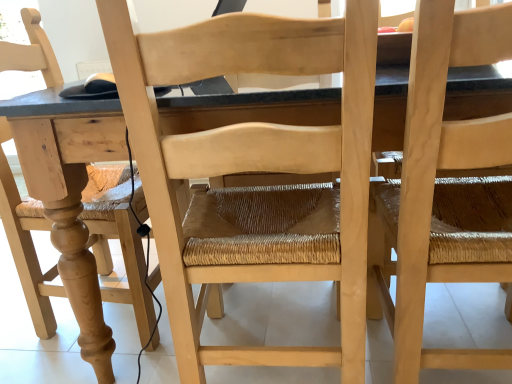
Question: Considering the relative sizes of natural wood chair at right, which is counted as the 2th chair, starting from the left, and natural wood chair at center, the first chair viewed from the left, in the image provided, is natural wood chair at right, which is counted as the 2th chair, starting from the left, taller than natural wood chair at center, the first chair viewed from the left,?

Choices:
 (A) no
 (B) yes

Answer: (A)

Question: Considering the relative sizes of natural wood chair at right, which is counted as the 2th chair, starting from the left, and natural wood chair at center, the first chair viewed from the left, in the image provided, is natural wood chair at right, which is counted as the 2th chair, starting from the left, bigger than natural wood chair at center, the first chair viewed from the left,?

Choices:
 (A) yes
 (B) no

Answer: (B)

Question: Can you confirm if natural wood chair at right, positioned as the first chair in right-to-left order, is smaller than natural wood chair at center, the first chair viewed from the left?

Choices:
 (A) no
 (B) yes

Answer: (B)

Question: Is natural wood chair at right, which is counted as the 2th chair, starting from the left, facing towards natural wood chair at center, the first chair viewed from the left?

Choices:
 (A) no
 (B) yes

Answer: (A)

Question: Is natural wood chair at right, positioned as the first chair in right-to-left order, closer to camera compared to natural wood chair at center, which is the 2th chair from right to left?

Choices:
 (A) yes
 (B) no

Answer: (A)

Question: From the image's perspective, is natural wood chair at right, positioned as the first chair in right-to-left order, on top of natural wood chair at center, the first chair viewed from the left?

Choices:
 (A) no
 (B) yes

Answer: (A)

Question: Is the position of natural wood chair at center, the first chair viewed from the left, less distant than that of natural wood chair at right, positioned as the first chair in right-to-left order?

Choices:
 (A) no
 (B) yes

Answer: (A)

Question: Does natural wood chair at center, the first chair viewed from the left, appear on the left side of natural wood chair at right, which is counted as the 2th chair, starting from the left?

Choices:
 (A) no
 (B) yes

Answer: (B)

Question: Are natural wood chair at center, the first chair viewed from the left, and natural wood chair at right, positioned as the first chair in right-to-left order, located far from each other?

Choices:
 (A) yes
 (B) no

Answer: (B)

Question: Can you see natural wood chair at center, the first chair viewed from the left, touching natural wood chair at right, positioned as the first chair in right-to-left order?

Choices:
 (A) yes
 (B) no

Answer: (B)

Question: Considering the relative positions of natural wood chair at center, the first chair viewed from the left, and natural wood chair at right, which is counted as the 2th chair, starting from the left, in the image provided, is natural wood chair at center, the first chair viewed from the left, to the right of natural wood chair at right, which is counted as the 2th chair, starting from the left, from the viewer's perspective?

Choices:
 (A) no
 (B) yes

Answer: (A)

Question: Is natural wood chair at center, which is the 2th chair from right to left, bigger than natural wood chair at right, which is counted as the 2th chair, starting from the left?

Choices:
 (A) yes
 (B) no

Answer: (A)

Question: Is the depth of natural wood table at center greater than that of natural wood chair at right, positioned as the first chair in right-to-left order?

Choices:
 (A) no
 (B) yes

Answer: (B)